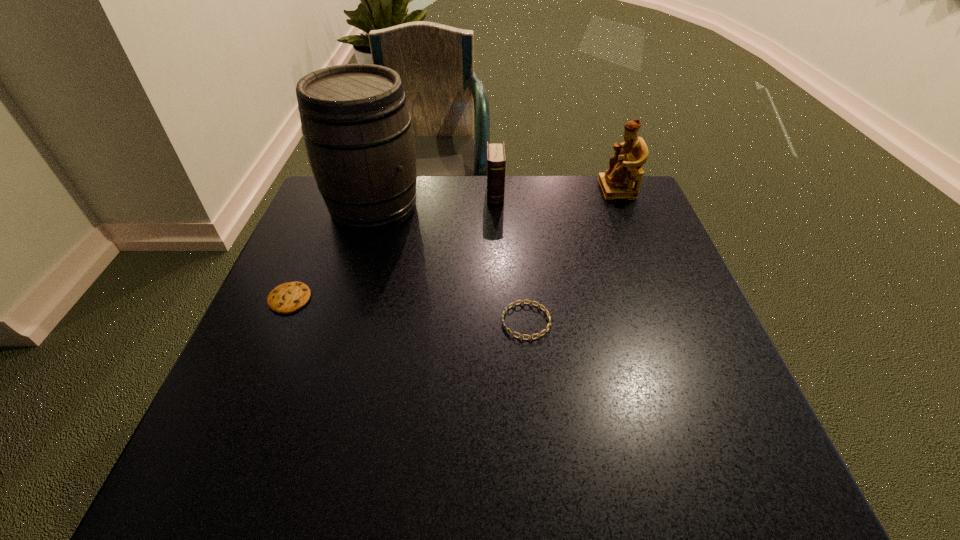
Where is `the tallest object`? The height and width of the screenshot is (540, 960). the tallest object is located at coordinates (357, 130).

Find the location of a particular element. The image size is (960, 540). the rightmost object is located at coordinates (618, 182).

You are a GUI agent. You are given a task and a screenshot of the screen. Output one action in this format:
    pyautogui.click(x=<x>, y=<y>)
    Task: Click on the figurine
    The height and width of the screenshot is (540, 960).
    Given the screenshot: What is the action you would take?
    pyautogui.click(x=618, y=182)

What are the coordinates of `diary` in the screenshot? It's located at (496, 160).

Where is `bracelet`? This screenshot has height=540, width=960. bracelet is located at coordinates (x=530, y=302).

Where is `cookie`? The height and width of the screenshot is (540, 960). cookie is located at coordinates (286, 298).

This screenshot has height=540, width=960. What are the coordinates of `free spot located 0.220m on the front of the wine bucket` in the screenshot? It's located at (x=346, y=302).

Locate an element on the screen. This screenshot has height=540, width=960. free spot located on the front-facing side of the fourth shortest object is located at coordinates (510, 189).

Where is `free space located on the front-facing side of the fourth shortest object`? Image resolution: width=960 pixels, height=540 pixels. free space located on the front-facing side of the fourth shortest object is located at coordinates (544, 189).

What are the coordinates of `vacant space located 0.290m on the front-facing side of the fourth shortest object` in the screenshot? It's located at (499, 189).